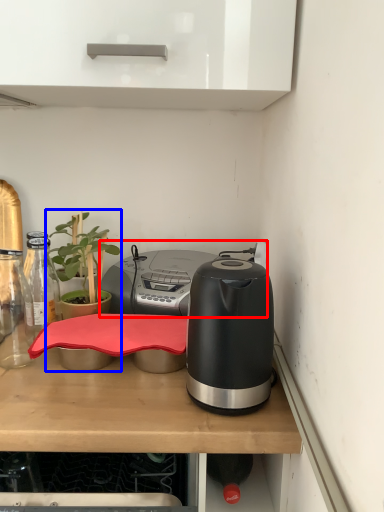
Question: Which of the following is the farthest to the observer, appliance (highlighted by a red box) or houseplant (highlighted by a blue box)?

Choices:
 (A) appliance
 (B) houseplant

Answer: (A)